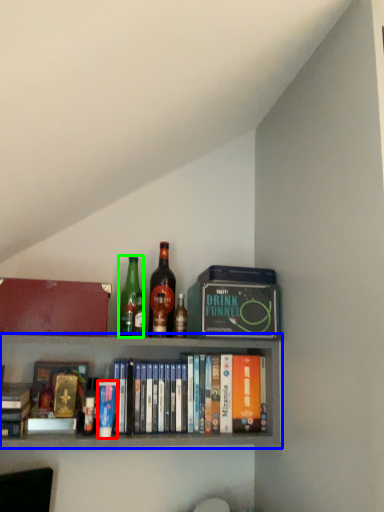
Question: Which is farther away from paperback book (highlighted by a red box)? shelf (highlighted by a blue box) or bottle (highlighted by a green box)?

Choices:
 (A) shelf
 (B) bottle

Answer: (B)